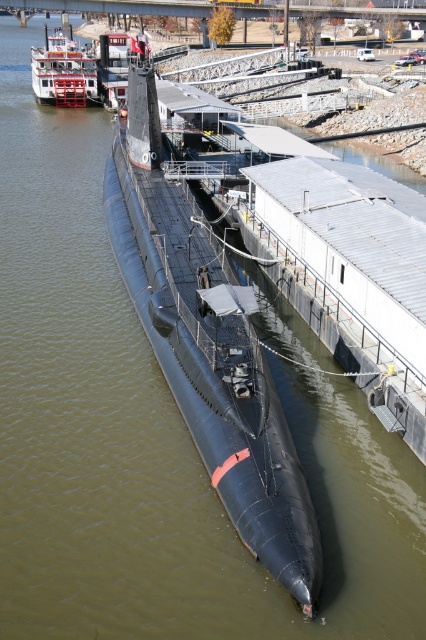
You are a ship captain who needs to dock your vessel at the pier. Your ship requires a minimum of 50 meters of space between it and any other vessel to safely maneuver. Based on the image, can you safely dock your ship between the black rubber submarine at center and the red painted wood paddlewheel boat at upper left?

The black rubber submarine at center is 74.82 meters from the red painted wood paddlewheel boat at upper left. Since this distance exceeds the required 50 meters, you can safely dock your ship between them.

You are standing on the pier looking at the submarine. There are two points marked on the submarine, one at coordinates point [221,269] and the other at point [55,83]. Which point is closer to you?

The point at [221,269] is closer to you than the point at [55,83].